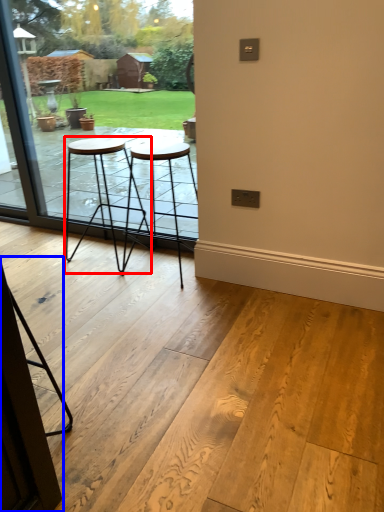
Question: Which point is closer to the camera, stool (highlighted by a red box) or screen door (highlighted by a blue box)?

Choices:
 (A) stool
 (B) screen door

Answer: (B)